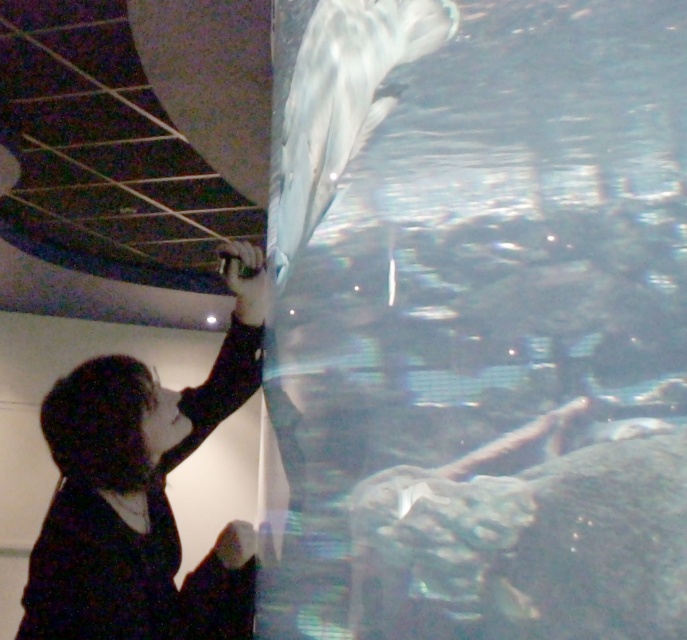
Which is more to the right, black matte jacket at lower left or white glossy dolphin at upper center?

Positioned to the right is white glossy dolphin at upper center.

Is black matte jacket at lower left in front of white glossy dolphin at upper center?

No, it is behind white glossy dolphin at upper center.

Does point (238, 273) come farther from viewer compared to point (271, 196)?

Yes, point (238, 273) is behind point (271, 196).

The width and height of the screenshot is (687, 640). What are the coordinates of `black matte jacket at lower left` in the screenshot? It's located at (142, 492).